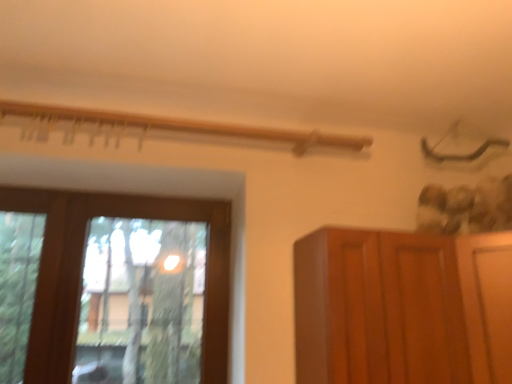
Question: Is point (481, 246) closer or farther from the camera than point (64, 269)?

Choices:
 (A) farther
 (B) closer

Answer: (B)

Question: Considering the positions of brown wooden cupboard at right and transparent glass window at left in the image, is brown wooden cupboard at right taller or shorter than transparent glass window at left?

Choices:
 (A) short
 (B) tall

Answer: (A)

Question: From the image's perspective, is brown wooden cupboard at right above or below transparent glass window at left?

Choices:
 (A) below
 (B) above

Answer: (A)

Question: Considering the positions of transparent glass window at left and brown wooden cupboard at right in the image, is transparent glass window at left taller or shorter than brown wooden cupboard at right?

Choices:
 (A) tall
 (B) short

Answer: (A)

Question: Is transparent glass window at left wider or thinner than brown wooden cupboard at right?

Choices:
 (A) wide
 (B) thin

Answer: (B)

Question: From a real-world perspective, is transparent glass window at left above or below brown wooden cupboard at right?

Choices:
 (A) below
 (B) above

Answer: (B)

Question: From the image's perspective, is transparent glass window at left above or below brown wooden cupboard at right?

Choices:
 (A) above
 (B) below

Answer: (A)